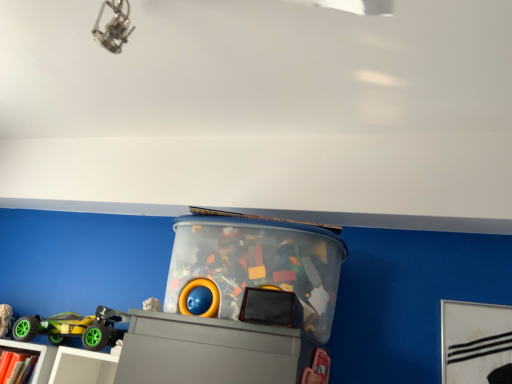
Question: Is matte gray shelf at lower left facing away from matte white bookcase at lower left?

Choices:
 (A) yes
 (B) no

Answer: (A)

Question: Could you tell me if matte gray shelf at lower left is turned towards matte white bookcase at lower left?

Choices:
 (A) no
 (B) yes

Answer: (B)

Question: Does matte gray shelf at lower left have a smaller size compared to matte white bookcase at lower left?

Choices:
 (A) no
 (B) yes

Answer: (A)

Question: From the image's perspective, is matte gray shelf at lower left located above matte white bookcase at lower left?

Choices:
 (A) yes
 (B) no

Answer: (B)

Question: Is matte gray shelf at lower left closer to camera compared to matte white bookcase at lower left?

Choices:
 (A) no
 (B) yes

Answer: (B)

Question: From a real-world perspective, is matte gray shelf at lower left physically located above or below green rubber toy car at lower left, placed as the second toy when sorted from right to left?

Choices:
 (A) below
 (B) above

Answer: (A)

Question: Considering the positions of matte gray shelf at lower left and green rubber toy car at lower left, which appears as the first toy when viewed from the left, in the image, is matte gray shelf at lower left wider or thinner than green rubber toy car at lower left, which appears as the first toy when viewed from the left,?

Choices:
 (A) wide
 (B) thin

Answer: (A)

Question: From the image's perspective, is matte gray shelf at lower left positioned above or below green rubber toy car at lower left, placed as the second toy when sorted from right to left?

Choices:
 (A) below
 (B) above

Answer: (A)

Question: In terms of size, does matte gray shelf at lower left appear bigger or smaller than green rubber toy car at lower left, which appears as the first toy when viewed from the left?

Choices:
 (A) big
 (B) small

Answer: (A)

Question: Which is correct: transparent plastic container at center, which ranks as the 2th toy in left-to-right order, is inside matte gray shelf at lower left, or outside of it?

Choices:
 (A) inside
 (B) outside

Answer: (B)

Question: From the image's perspective, is transparent plastic container at center, which ranks as the 2th toy in left-to-right order, above or below matte gray shelf at lower left?

Choices:
 (A) above
 (B) below

Answer: (A)

Question: Considering the relative positions of transparent plastic container at center, the 1th toy when ordered from right to left, and matte gray shelf at lower left in the image provided, is transparent plastic container at center, the 1th toy when ordered from right to left, to the left or to the right of matte gray shelf at lower left?

Choices:
 (A) left
 (B) right

Answer: (B)

Question: From their relative heights in the image, would you say transparent plastic container at center, which ranks as the 2th toy in left-to-right order, is taller or shorter than matte gray shelf at lower left?

Choices:
 (A) tall
 (B) short

Answer: (A)

Question: From the image's perspective, is matte gray shelf at lower left positioned above or below matte white bookcase at lower left?

Choices:
 (A) above
 (B) below

Answer: (B)

Question: Is point (104, 362) closer or farther from the camera than point (41, 367)?

Choices:
 (A) closer
 (B) farther

Answer: (A)